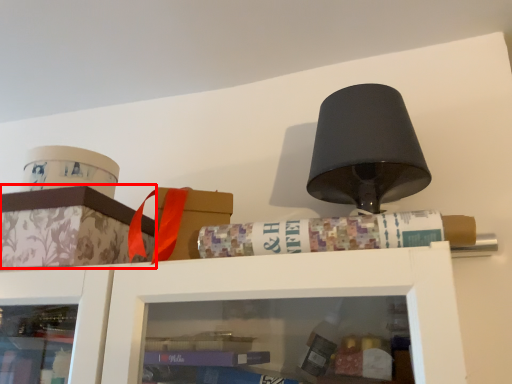
Question: Considering the relative positions of cabinetry (annotated by the red box) and book in the image provided, where is cabinetry (annotated by the red box) located with respect to the staircase?

Choices:
 (A) right
 (B) left

Answer: (B)